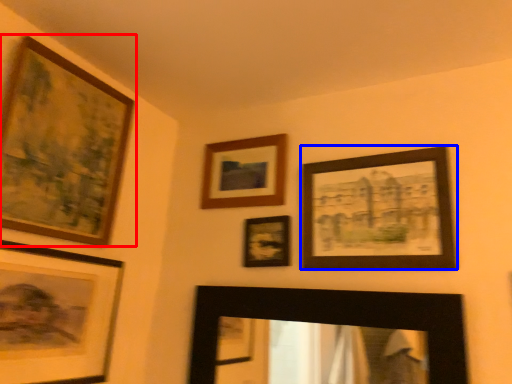
Question: Which object appears farthest to the camera in this image, picture frame (highlighted by a red box) or picture frame (highlighted by a blue box)?

Choices:
 (A) picture frame
 (B) picture frame

Answer: (B)